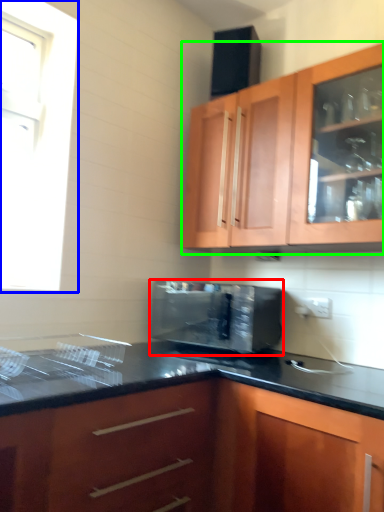
Question: Which object is positioned farthest from microwave oven (highlighted by a red box)? Select from window (highlighted by a blue box) and cabinetry (highlighted by a green box).

Choices:
 (A) window
 (B) cabinetry

Answer: (A)